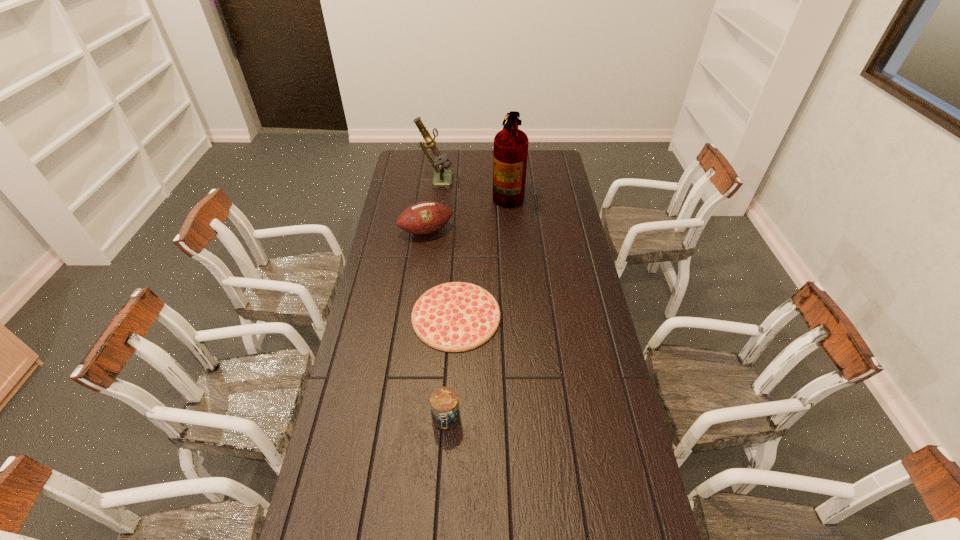
Image resolution: width=960 pixels, height=540 pixels. I want to click on blank space located at the nozzle of the tallest object, so click(x=412, y=193).

Where is `blank area located 0.090m at the eyepiece of the second tallest object`? blank area located 0.090m at the eyepiece of the second tallest object is located at coordinates (470, 178).

Locate an element on the screen. Image resolution: width=960 pixels, height=540 pixels. free spot located 0.350m on the front of the third farthest object is located at coordinates (417, 301).

This screenshot has height=540, width=960. Identify the location of vacant space located 0.240m on the lid of the second shortest object. (440, 524).

The height and width of the screenshot is (540, 960). I want to click on free space located on the back of the pizza, so click(461, 222).

You are a GUI agent. You are given a task and a screenshot of the screen. Output one action in this format:
    pyautogui.click(x=<x>, y=<y>)
    Task: Click on the fire extinguisher that is at the far edge
    The width and height of the screenshot is (960, 540).
    Given the screenshot: What is the action you would take?
    pyautogui.click(x=510, y=155)

Image resolution: width=960 pixels, height=540 pixels. What are the coordinates of `microscope at the far edge` in the screenshot? It's located at (442, 178).

Find the location of a particular element. Image resolution: width=960 pixels, height=540 pixels. microscope positioned at the left edge is located at coordinates (442, 178).

The image size is (960, 540). I want to click on football (American) positioned at the left edge, so click(x=422, y=218).

Locate an element on the screen. object present at the far left corner is located at coordinates (442, 178).